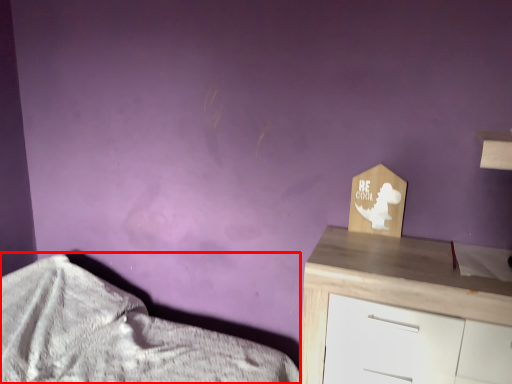
Question: Observing the image, what is the correct spatial positioning of bed (annotated by the red box) in reference to chest of drawers?

Choices:
 (A) left
 (B) right

Answer: (A)